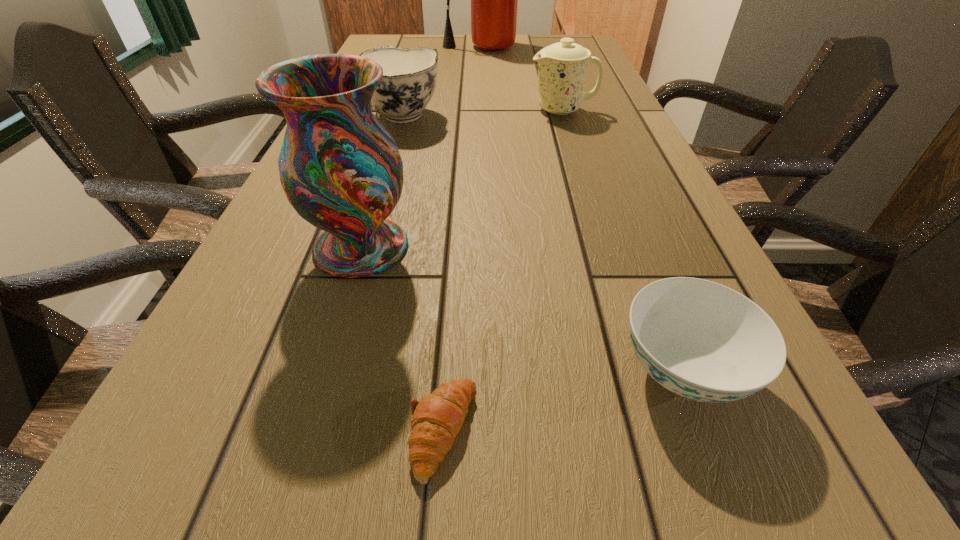
Find the location of a particular element. This screenshot has height=540, width=960. free point located 0.370m on the instruction side of the tallest object is located at coordinates (483, 99).

Locate an element on the screen. vacant area located 0.350m on the back of the third nearest object is located at coordinates (396, 130).

Where is `vacant space located 0.330m on the spout of the fourth shortest object`? The width and height of the screenshot is (960, 540). vacant space located 0.330m on the spout of the fourth shortest object is located at coordinates (401, 110).

This screenshot has height=540, width=960. What are the coordinates of `vacant space located on the spout of the fourth shortest object` in the screenshot? It's located at (452, 110).

What are the coordinates of `vacant space located on the spout of the fourth shortest object` in the screenshot? It's located at (386, 110).

Where is `free space located 0.210m on the front of the second tallest chinaware`? free space located 0.210m on the front of the second tallest chinaware is located at coordinates (379, 190).

Find the location of `vacant space located on the front of the second shortest object`. vacant space located on the front of the second shortest object is located at coordinates (748, 539).

Find the location of `free region located 0.310m on the right of the crescent roll`. free region located 0.310m on the right of the crescent roll is located at coordinates (743, 430).

The height and width of the screenshot is (540, 960). In order to click on object located in the far edge section of the desktop in this screenshot , I will do `click(494, 0)`.

In order to click on vase located at the left edge in this screenshot , I will do `click(342, 172)`.